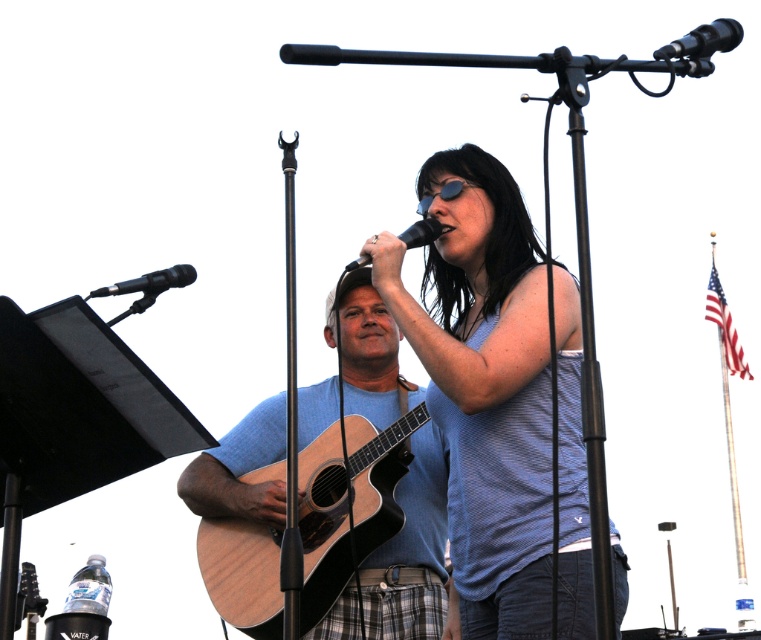
You are a stagehand who needs to place a new speaker that is the same size as the natural wood acoustic guitar at center. Can you fit it in the space currently occupied by the black matte microphone at upper left?

The natural wood acoustic guitar at center has a larger size compared to the black matte microphone at upper left. Since the speaker is the same size as the guitar, it would not fit in the space occupied by the microphone.

You are a stagehand adjusting the lighting for the performance. You need to position a spotlight on the blue textured tank top at center and the black matte microphone at center. According to the scene, which object is located to the right of the other?

The blue textured tank top at center is to the right of the black matte microphone at center.

You are a sound technician adjusting the stage setup. You need to place a new microphone stand that requires more space. Which microphone, the black matte microphone at upper left or the black matte microphone at center, should you choose to accommodate the larger stand?

The black matte microphone at upper left has a larger width than the black matte microphone at center, so you should choose the black matte microphone at upper left to accommodate the larger stand.